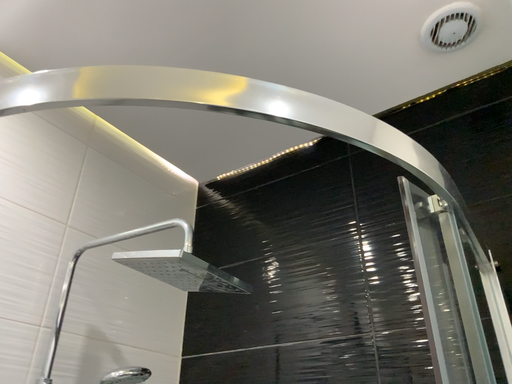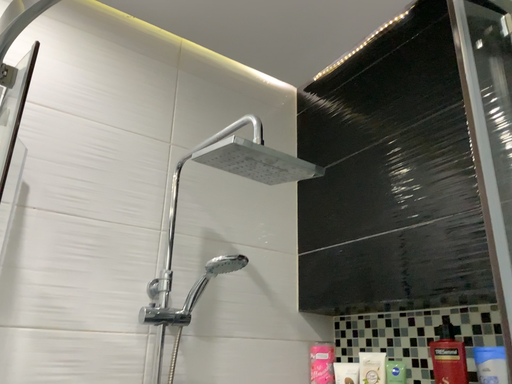
Question: Which way did the camera rotate in the video?

Choices:
 (A) rotated right
 (B) rotated left

Answer: (B)